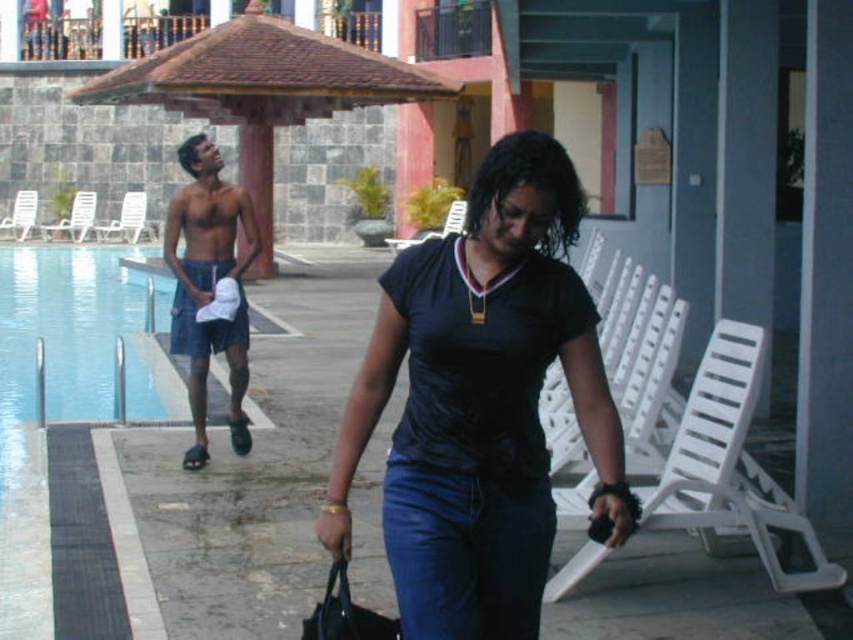
Does black matte bag at lower center have a greater width compared to brown leather sandal at lower left?

Correct, the width of black matte bag at lower center exceeds that of brown leather sandal at lower left.

Find the location of a particular element. black matte bag at lower center is located at coordinates (345, 612).

The height and width of the screenshot is (640, 853). Describe the element at coordinates (345, 612) in the screenshot. I see `black matte bag at lower center` at that location.

Find the location of a particular element. This screenshot has width=853, height=640. black matte bag at lower center is located at coordinates tap(345, 612).

What do you see at coordinates (209, 280) in the screenshot?
I see `blue denim shorts at left` at bounding box center [209, 280].

Which of these two, blue denim shorts at left or black matte bag at lower center, stands shorter?

With less height is black matte bag at lower center.

The width and height of the screenshot is (853, 640). What are the coordinates of `blue denim shorts at left` in the screenshot? It's located at (209, 280).

In the scene shown: Does matte black shirt at center lie in front of black matte bag at lower center?

Yes.

This screenshot has width=853, height=640. In order to click on matte black shirt at center in this screenshot , I will do `click(480, 403)`.